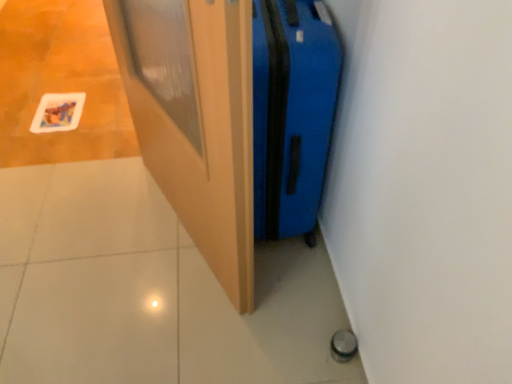
The image size is (512, 384). Find the location of `free location in front of wooden door at center`. free location in front of wooden door at center is located at coordinates (160, 313).